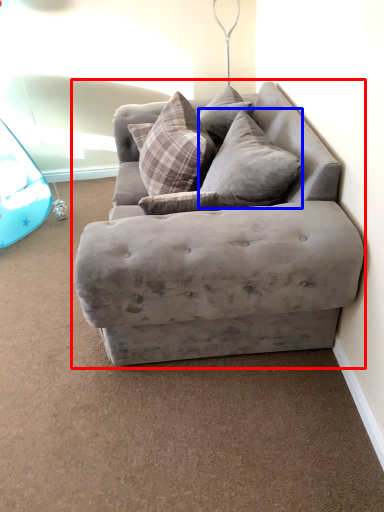
Question: Which object appears farthest to the camera in this image, studio couch (highlighted by a red box) or pillow (highlighted by a blue box)?

Choices:
 (A) studio couch
 (B) pillow

Answer: (B)